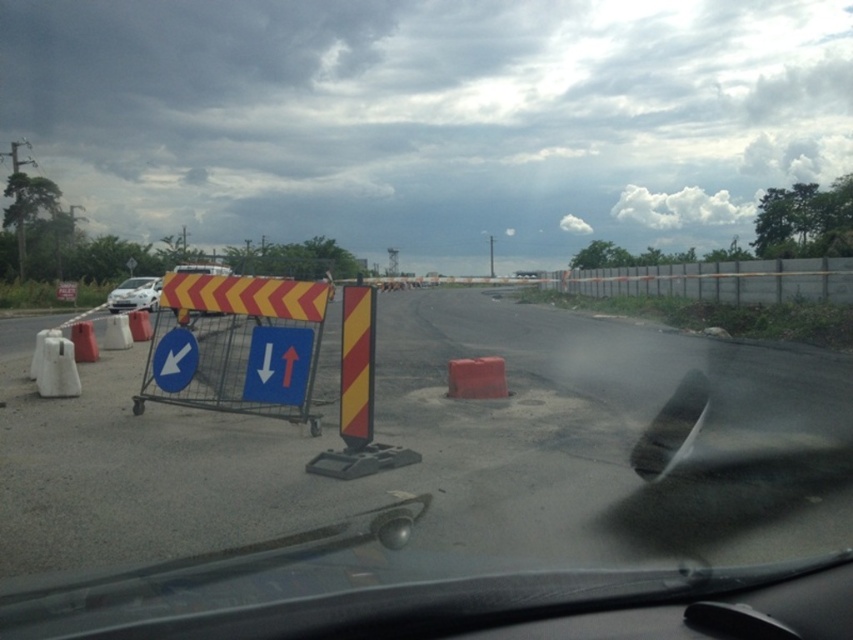
From the picture: You are a driver looking through the transparent glass windshield at center and see the blue plastic arrow at left. Which object is closer to your current position?

The transparent glass windshield at center is closer to your current position because it is located to the right of the blue plastic arrow at left, which is further away.